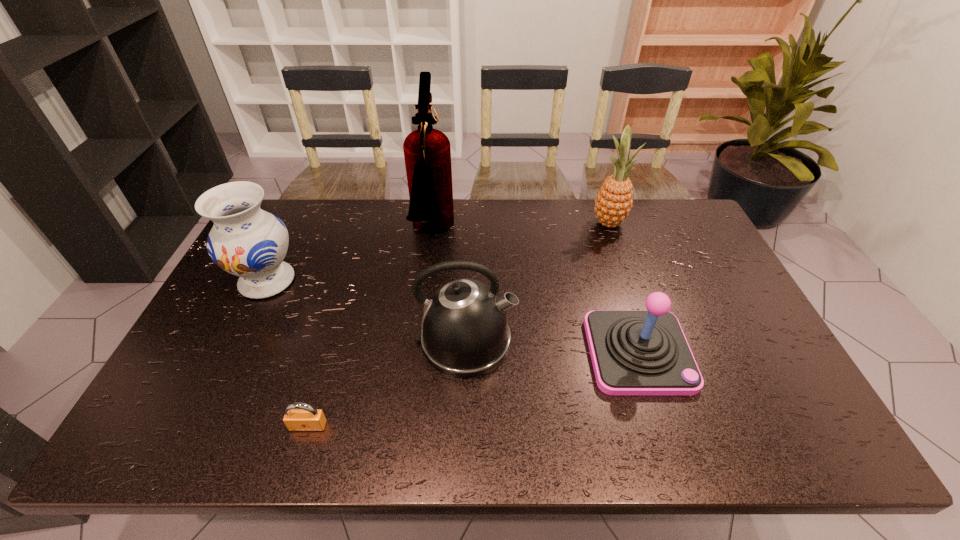
Where is `vacant point located between the vase and the pineapple`? The width and height of the screenshot is (960, 540). vacant point located between the vase and the pineapple is located at coordinates (438, 252).

This screenshot has height=540, width=960. What are the coordinates of `object that is the fourth closest to the pineapple` in the screenshot? It's located at (246, 241).

Locate an element on the screen. This screenshot has height=540, width=960. the fourth closest object to the kettle is located at coordinates (246, 241).

Where is `vacant space that satisfies the following two spatial constraints: 1. on the front side of the pineapple; 2. at the nozzle of the fire extinguisher`? This screenshot has height=540, width=960. vacant space that satisfies the following two spatial constraints: 1. on the front side of the pineapple; 2. at the nozzle of the fire extinguisher is located at coordinates (612, 232).

Image resolution: width=960 pixels, height=540 pixels. In order to click on vacant space that satisfies the following two spatial constraints: 1. on the spout of the kettle; 2. to unlock the padlock from the front in this screenshot , I will do `click(463, 426)`.

What are the coordinates of `vacant region that satisfies the following two spatial constraints: 1. at the nozzle of the fire extinguisher; 2. to unlock the padlock from the front` in the screenshot? It's located at (408, 426).

Where is `free spot that satisfies the following two spatial constraints: 1. on the spout of the kettle; 2. to unlock the padlock from the front`? free spot that satisfies the following two spatial constraints: 1. on the spout of the kettle; 2. to unlock the padlock from the front is located at coordinates (463, 426).

You are a GUI agent. You are given a task and a screenshot of the screen. Output one action in this format:
    pyautogui.click(x=<x>, y=<y>)
    Task: Click on the blank space that satisfies the following two spatial constraints: 1. at the nozzle of the tallest object; 2. to unlock the fifth object from right to left from the front
    This screenshot has width=960, height=540.
    Given the screenshot: What is the action you would take?
    [408, 426]